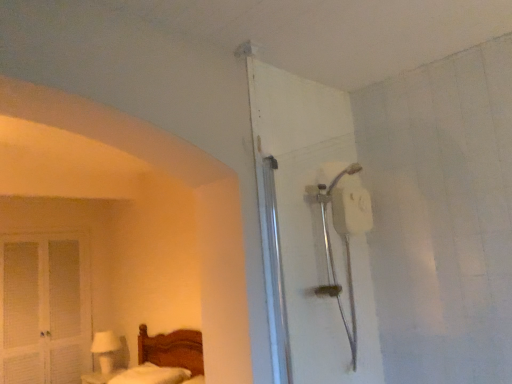
This screenshot has height=384, width=512. In order to click on free space above white louvered screen door at left (from a real-world perspective) in this screenshot , I will do `click(49, 220)`.